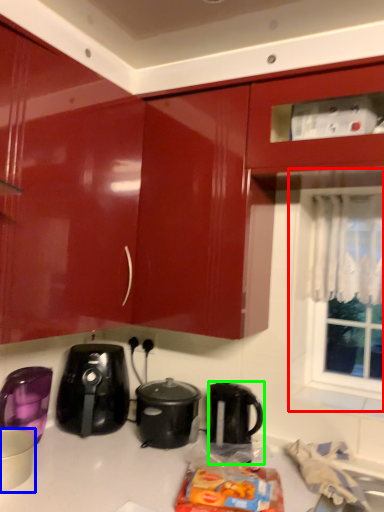
Question: Which object is positioned closest to window (highlighted by a red box)? Select from kitchen appliance (highlighted by a blue box) and kettle (highlighted by a green box).

Choices:
 (A) kitchen appliance
 (B) kettle

Answer: (B)